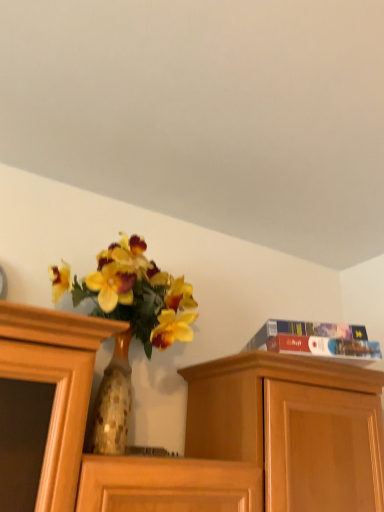
This screenshot has width=384, height=512. What do you see at coordinates (316, 340) in the screenshot?
I see `hardcover book at upper right` at bounding box center [316, 340].

Where is `hardcover book at upper right`? hardcover book at upper right is located at coordinates (316, 340).

You are a GUI agent. You are given a task and a screenshot of the screen. Output one action in this format:
    pyautogui.click(x=<x>, y=<y>)
    Task: Click on the hardcover book at upper right
    
    Given the screenshot: What is the action you would take?
    pyautogui.click(x=316, y=340)